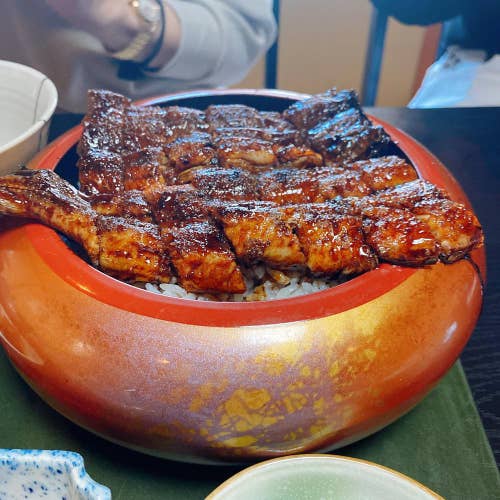
Locate an element on the screen. This screenshot has width=500, height=500. line on bowl which is in top left of image is located at coordinates (41, 143), (39, 90).